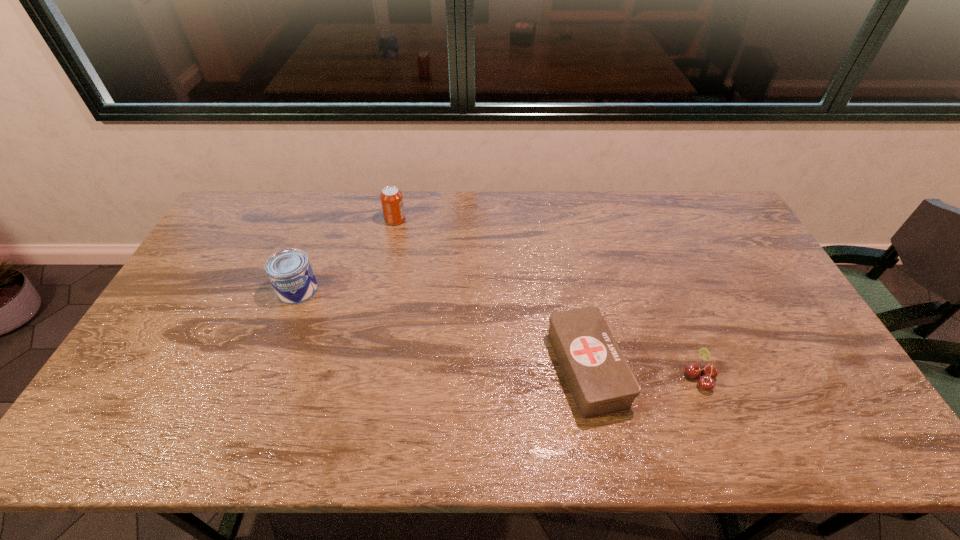
Locate an element on the screen. the farthest object is located at coordinates (391, 197).

Identify the location of the right can. The width and height of the screenshot is (960, 540). (391, 197).

You are a GUI agent. You are given a task and a screenshot of the screen. Output one action in this format:
    pyautogui.click(x=<x>, y=<y>)
    Task: Click on the nearer can
    This screenshot has height=540, width=960.
    Given the screenshot: What is the action you would take?
    pyautogui.click(x=289, y=271)

At what (x,y) coordinates should I click in order to perform the action: click on the left can. Please return your answer as a coordinate pair (x, y). The image size is (960, 540). Looking at the image, I should click on (289, 271).

Find the location of a particular element. The width and height of the screenshot is (960, 540). the second object from right to left is located at coordinates (601, 382).

Identify the location of cherry. (709, 371).

Locate an element on the screen. The image size is (960, 540). free point located 0.280m on the right of the right can is located at coordinates (484, 220).

This screenshot has width=960, height=540. In order to click on vacant area situated 0.260m on the front label of the third nearest object in this screenshot , I will do `click(262, 383)`.

Find the location of a particular element. The width and height of the screenshot is (960, 540). free space located 0.110m on the back of the first-aid kit is located at coordinates (572, 296).

Find the location of a particular element. The image size is (960, 540). vacant space located on the leaves of the rightmost object is located at coordinates (617, 377).